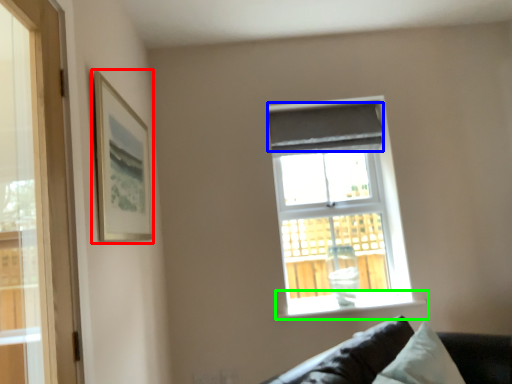
Question: Which object is positioned closest to picture frame (highlighted by a red box)? Select from curtain (highlighted by a blue box) and window sill (highlighted by a green box).

Choices:
 (A) curtain
 (B) window sill

Answer: (A)